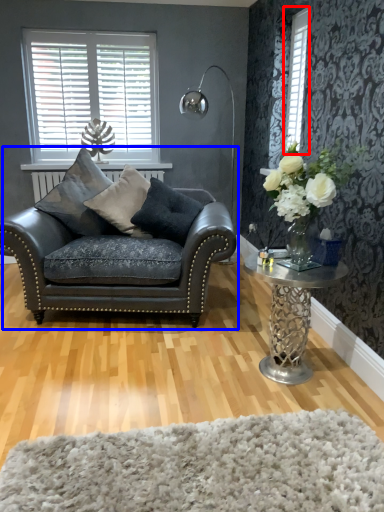
Question: Among these objects, which one is nearest to the camera, window (highlighted by a red box) or studio couch (highlighted by a blue box)?

Choices:
 (A) window
 (B) studio couch

Answer: (B)